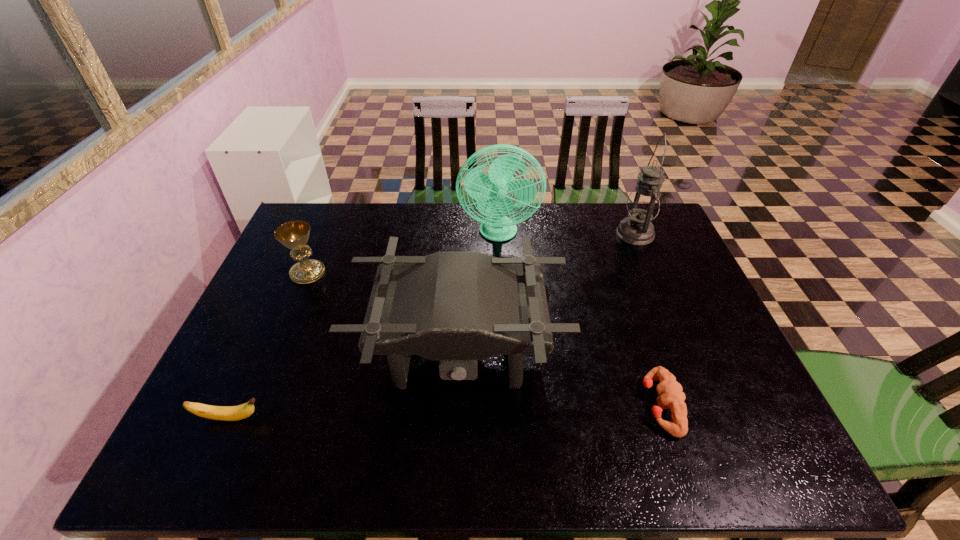
Find the location of a particular element. Image resolution: width=960 pixels, height=540 pixels. vacant space located with a camera mounted on the underside of the drone is located at coordinates (456, 457).

Find the location of `free space located on the right of the chalice`. free space located on the right of the chalice is located at coordinates (455, 273).

You are a GUI agent. You are given a task and a screenshot of the screen. Output one action in this format:
    pyautogui.click(x=<x>, y=<y>)
    Task: Click on the free space located at the stem of the banana
    This screenshot has width=960, height=540.
    Given the screenshot: What is the action you would take?
    pyautogui.click(x=351, y=418)

You are a GUI agent. You are given a task and a screenshot of the screen. Output one action in this format:
    pyautogui.click(x=<x>, y=<y>)
    Task: Click on the free space located with the gloves of the puncher facing forward
    
    Given the screenshot: What is the action you would take?
    pyautogui.click(x=480, y=405)

Find the location of a particular element. blank area located 0.400m with the gloves of the puncher facing forward is located at coordinates (467, 405).

You are a GUI agent. You are given a task and a screenshot of the screen. Output one action in this format:
    pyautogui.click(x=<x>, y=<y>)
    Task: Click on the free point located with the gloves of the puncher facing forward
    Image resolution: width=960 pixels, height=540 pixels.
    Given the screenshot: What is the action you would take?
    pyautogui.click(x=467, y=405)

Locate an element on the screen. Image resolution: width=960 pixels, height=540 pixels. oil lamp located at the far edge is located at coordinates (643, 204).

I want to click on fan at the far edge, so click(490, 191).

This screenshot has width=960, height=540. I want to click on object that is at the near edge, so click(x=670, y=393).

Find the location of a particular element. The width and height of the screenshot is (960, 540). chalice that is at the left edge is located at coordinates (294, 235).